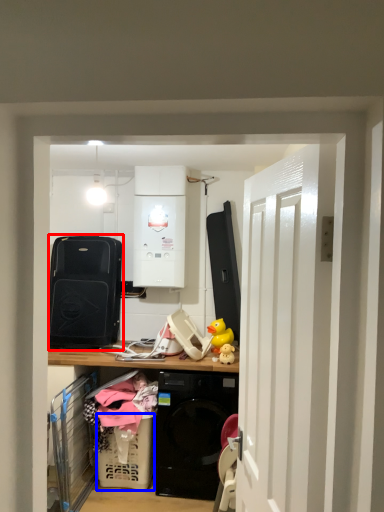
Question: Which object appears closest to the camera in this image, appliance (highlighted by a red box) or basket (highlighted by a blue box)?

Choices:
 (A) appliance
 (B) basket

Answer: (B)